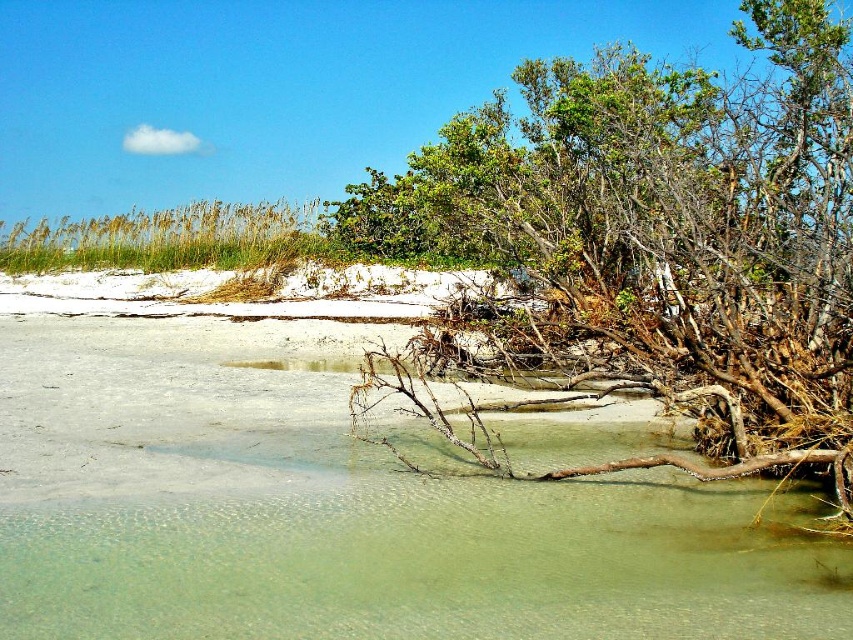
Which is more to the right, brown/dry wood at center-right or green grass at upper left?

Positioned to the right is brown/dry wood at center-right.

Is the position of brown/dry wood at center-right more distant than that of green grass at upper left?

That is False.

Where is `brown/dry wood at center-right`? brown/dry wood at center-right is located at coordinates (659, 237).

Locate an element on the screen. This screenshot has width=853, height=640. brown/dry wood at center-right is located at coordinates (659, 237).